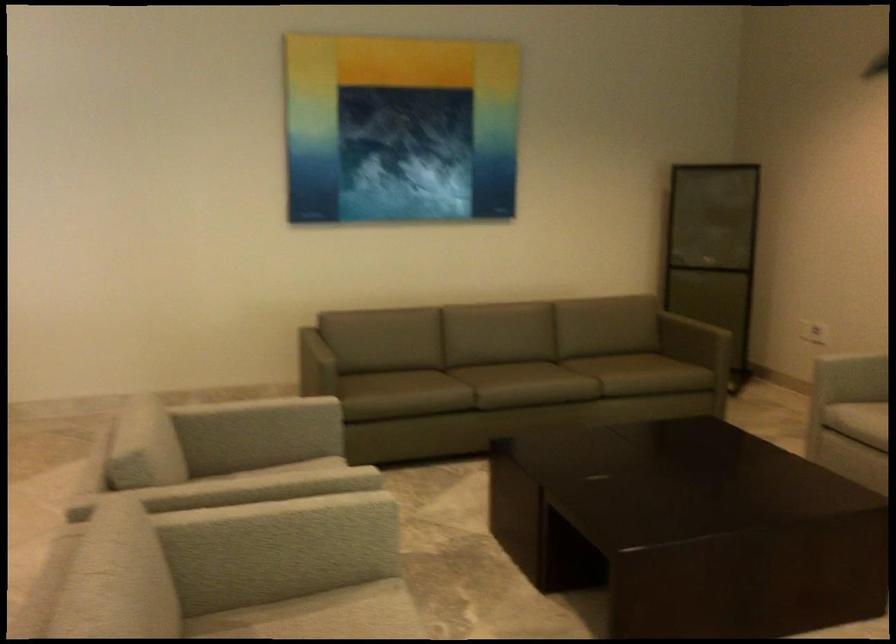
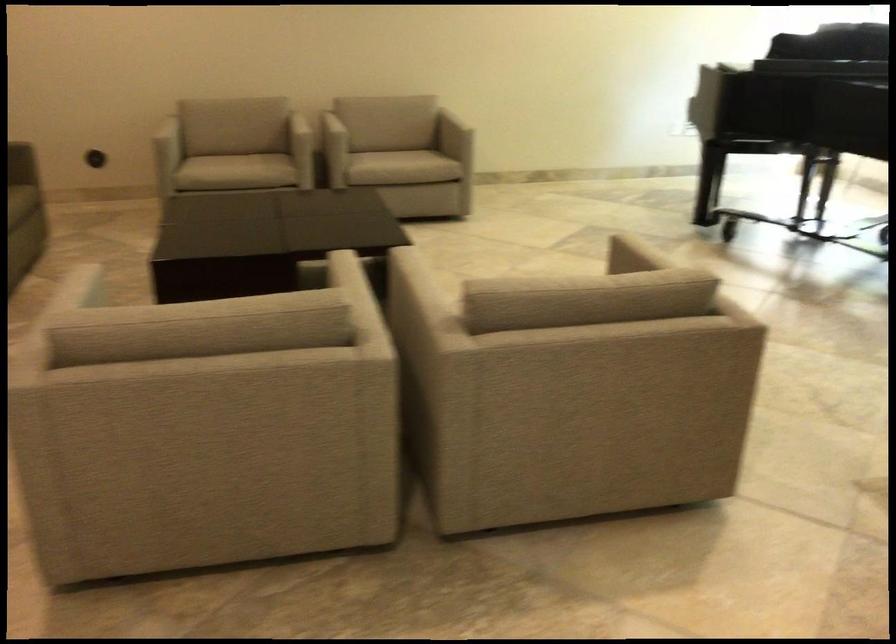
In the second image, find the point that corresponds to point 857,420 in the first image.

(210, 167)